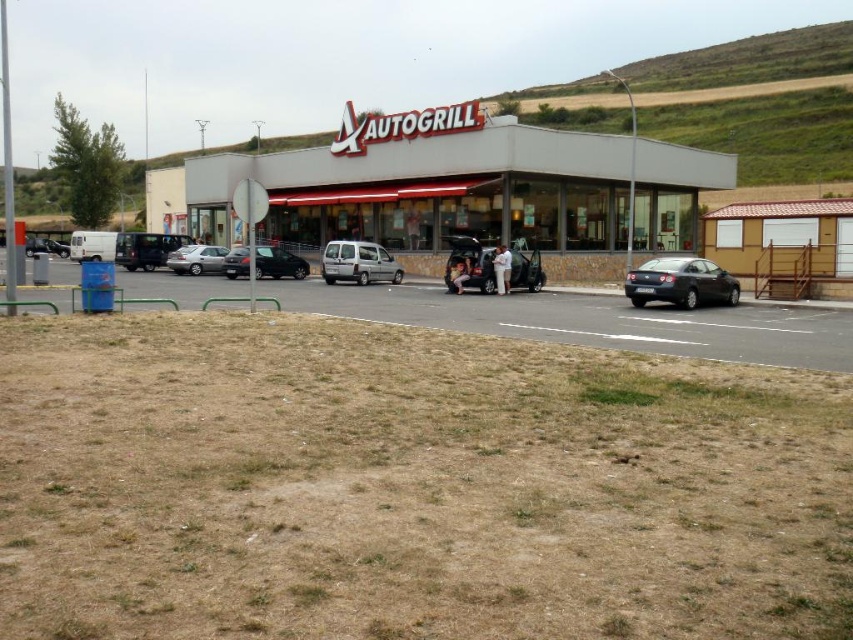
From the picture: You are standing at the camera position and want to walk to the point marked as point (x=321, y=243). How far will you have to walk in meters?

You will have to walk 48.53 meters to reach point (x=321, y=243) from the camera position.

Based on the photo, you are a delivery driver who needs to park your truck, which is 2.5 meters wide, in the parking lot of Autogrill. There is a silver metallic van at center and a white fabric person at center in the way. Can your truck fit between them?

The silver metallic van at center has a lesser width compared to white fabric person at center. Since the van is narrower than the person, there might not be enough space between them for your 2.5 meter wide truck to pass through safely. You should look for another parking spot.